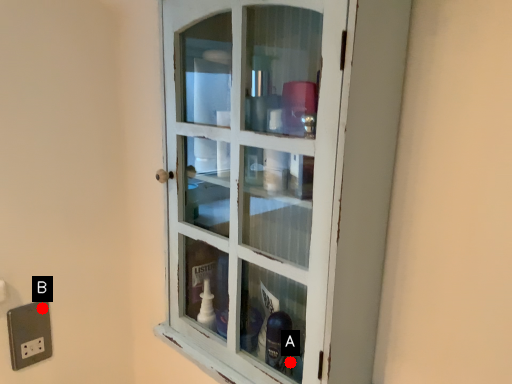
Question: Two points are circled on the image, labeled by A and B beside each circle. Which point is closer to the camera?

Choices:
 (A) A is closer
 (B) B is closer

Answer: (A)